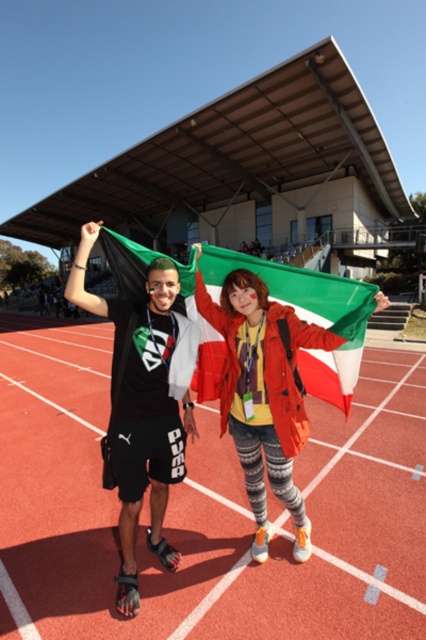
Does matte black shorts at left have a lesser height compared to matte green flag at center?

Incorrect, matte black shorts at left's height does not fall short of matte green flag at center's.

Between matte black shorts at left and matte green flag at center, which one is positioned higher?

matte black shorts at left

Is point (261, 404) farther from camera compared to point (293, 416)?

No, (261, 404) is in front of (293, 416).

Where is `matte black shorts at left`? This screenshot has width=426, height=640. matte black shorts at left is located at coordinates (265, 392).

Which is more to the left, matte green flag at center or black matte t-shirt at center?

Positioned to the left is black matte t-shirt at center.

Which of these two, matte green flag at center or black matte t-shirt at center, stands shorter?

matte green flag at center is shorter.

Is point (342, 337) behind point (154, 314)?

No, (342, 337) is in front of (154, 314).

Locate an element on the screen. matte green flag at center is located at coordinates (262, 392).

Can you confirm if black matte t-shirt at center is wider than greenmaterial/textureflag at center?

Incorrect, black matte t-shirt at center's width does not surpass greenmaterial/textureflag at center's.

This screenshot has width=426, height=640. I want to click on black matte t-shirt at center, so click(x=141, y=408).

Which is behind, point (120, 419) or point (348, 332)?

The point (120, 419) is behind.

Where is `black matte t-shirt at center`? The width and height of the screenshot is (426, 640). black matte t-shirt at center is located at coordinates (141, 408).